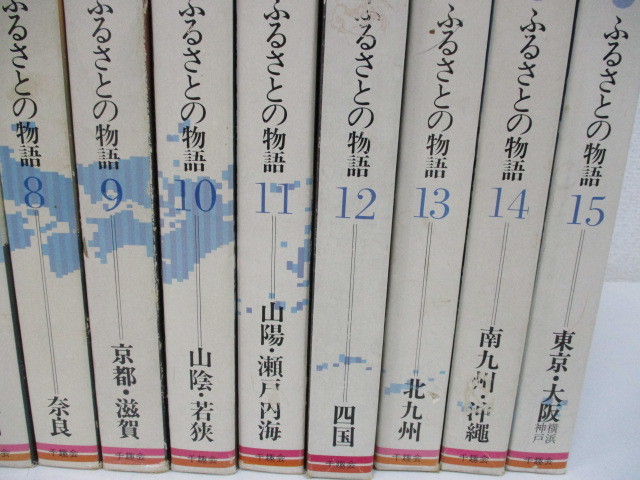
Locate an element on the screen. This screenshot has width=640, height=480. book 11 is located at coordinates (276, 229).